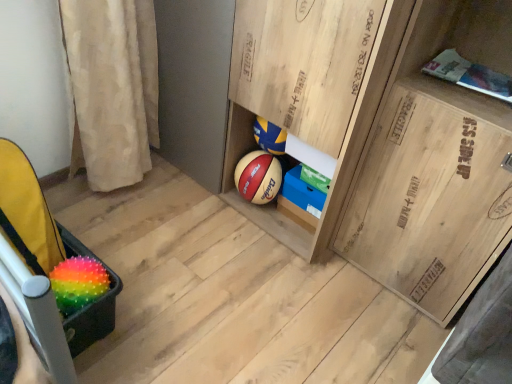
Locate an element on the screen. free area in between wooden cabinet at center, placed as the third cabinetry when sorted from right to left, and wooden crate at right, which appears as the first cabinetry when viewed from the right is located at coordinates (360, 281).